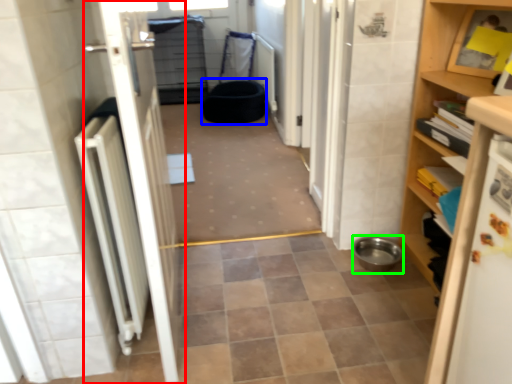
Question: Considering the real-world distances, which object is farthest from door (highlighted by a red box)? toilet bowl (highlighted by a blue box) or toilet bowl (highlighted by a green box)?

Choices:
 (A) toilet bowl
 (B) toilet bowl

Answer: (A)